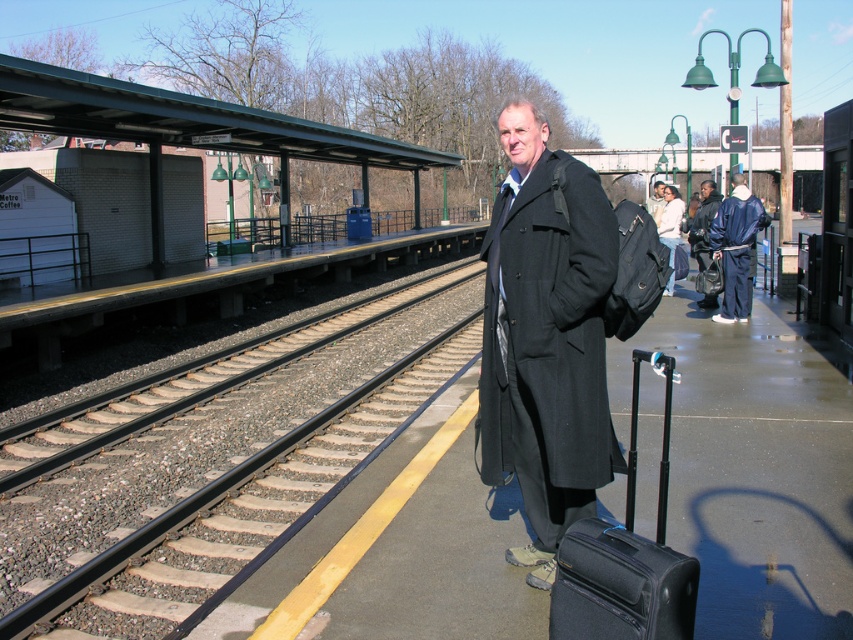
Find the location of a particular element. Image resolution: width=853 pixels, height=640 pixels. black hardshell suitcase at lower right is located at coordinates (625, 560).

Is point (663, 596) less distant than point (648, 212)?

Yes.

What do you see at coordinates (625, 560) in the screenshot? I see `black hardshell suitcase at lower right` at bounding box center [625, 560].

Locate an element on the screen. This screenshot has width=853, height=640. black hardshell suitcase at lower right is located at coordinates (625, 560).

Between black woolen coat at center and dark gray coat at center, which one appears on the left side from the viewer's perspective?

Positioned to the left is black woolen coat at center.

Can you confirm if black woolen coat at center is shorter than dark gray coat at center?

Yes, black woolen coat at center is shorter than dark gray coat at center.

Is point (576, 509) positioned in front of point (660, 186)?

Yes, point (576, 509) is closer to viewer.

The image size is (853, 640). Find the location of `black woolen coat at center`. black woolen coat at center is located at coordinates (546, 337).

The height and width of the screenshot is (640, 853). Describe the element at coordinates (206, 483) in the screenshot. I see `black metal train track at left` at that location.

Who is shorter, black metal train track at left or dark blue jacket at center?

black metal train track at left

Image resolution: width=853 pixels, height=640 pixels. Find the location of `black metal train track at left`. black metal train track at left is located at coordinates (206, 483).